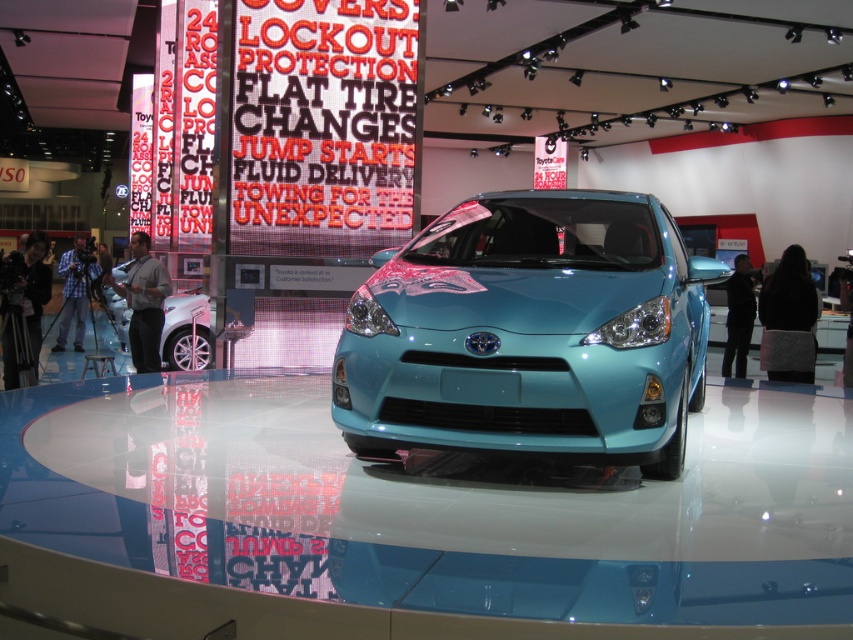
Question: Which object is farther from the camera taking this photo?

Choices:
 (A) teal glossy concept car at center
 (B) matte black car at left

Answer: (B)

Question: Is teal glossy concept car at center to the right of matte black car at left from the viewer's perspective?

Choices:
 (A) yes
 (B) no

Answer: (A)

Question: Which of the following is the closest to the observer?

Choices:
 (A) matte black car at left
 (B) teal glossy concept car at center

Answer: (B)

Question: Does teal glossy concept car at center have a smaller size compared to matte black car at left?

Choices:
 (A) no
 (B) yes

Answer: (A)

Question: From the image, what is the correct spatial relationship of teal glossy concept car at center in relation to matte black car at left?

Choices:
 (A) left
 (B) right

Answer: (B)